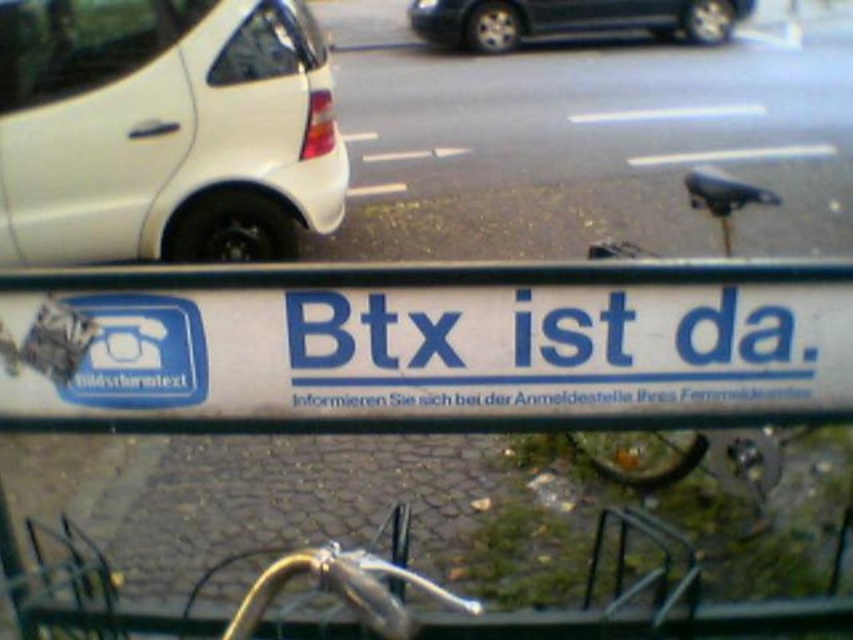
Question: Is white plastic sign at center smaller than black glossy car at upper center?

Choices:
 (A) yes
 (B) no

Answer: (A)

Question: Which object appears closest to the camera in this image?

Choices:
 (A) white plastic sign at center
 (B) white matte car at left
 (C) black glossy car at upper center

Answer: (A)

Question: Considering the real-world distances, which object is closest to the black glossy car at upper center?

Choices:
 (A) white matte car at left
 (B) white plastic sign at center

Answer: (A)

Question: Does white plastic sign at center have a larger size compared to white matte car at left?

Choices:
 (A) yes
 (B) no

Answer: (B)

Question: Does white plastic sign at center appear on the left side of white matte car at left?

Choices:
 (A) yes
 (B) no

Answer: (B)

Question: Which of these objects is positioned closest to the white plastic sign at center?

Choices:
 (A) black glossy car at upper center
 (B) white matte car at left

Answer: (B)